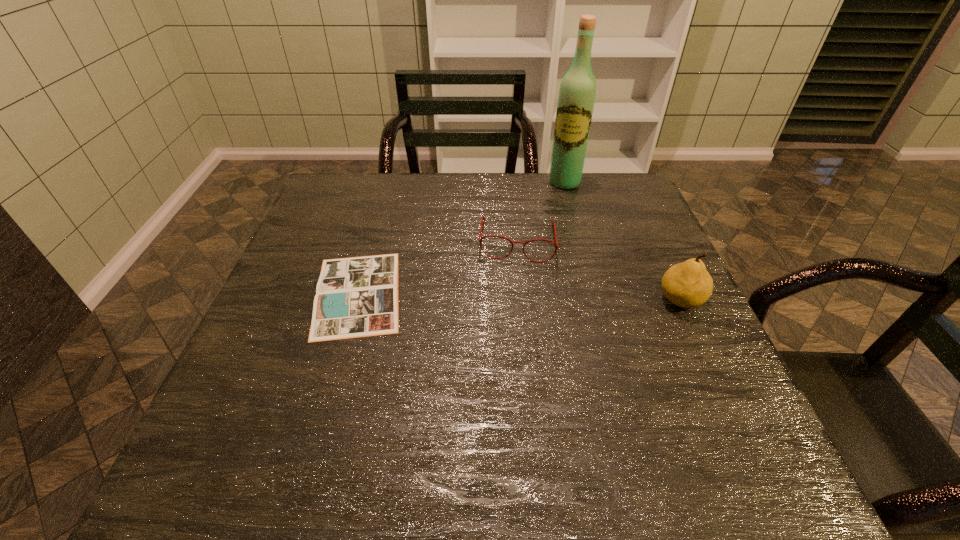
At what (x,y) coordinates should I click in order to perform the action: click on vacant space in between the third object from right to left and the book. Please return your answer as a coordinate pair (x, y). Image resolution: width=960 pixels, height=540 pixels. Looking at the image, I should click on (438, 267).

The width and height of the screenshot is (960, 540). In order to click on vacant region between the wine bottle and the spectacles in this screenshot , I will do `click(541, 212)`.

Where is `free space between the rightmost object and the spectacles`? free space between the rightmost object and the spectacles is located at coordinates (599, 271).

I want to click on empty location between the third object from left to right and the pear, so click(x=622, y=241).

Where is `empty space that is in between the book and the spectacles`? The image size is (960, 540). empty space that is in between the book and the spectacles is located at coordinates (438, 267).

Identify the location of free area in between the shortest object and the spectacles. The width and height of the screenshot is (960, 540). (438, 267).

Locate which object is the third closest to the second tallest object. Please provide its 2D coordinates. Your answer should be formatted as a tuple, i.e. [(x, y)], where the tuple contains the x and y coordinates of a point satisfying the conditions above.

[(355, 297)]

Identify which object is the second nearest to the second tallest object. Please provide its 2D coordinates. Your answer should be formatted as a tuple, i.e. [(x, y)], where the tuple contains the x and y coordinates of a point satisfying the conditions above.

[(577, 92)]

Identify the location of free space that satisfies the following two spatial constraints: 1. on the back side of the book; 2. on the right side of the farthest object. The width and height of the screenshot is (960, 540). (390, 182).

The image size is (960, 540). What are the coordinates of `blank area in the image that satisfies the following two spatial constraints: 1. on the back side of the book; 2. on the left side of the third object from right to left` in the screenshot? It's located at (372, 241).